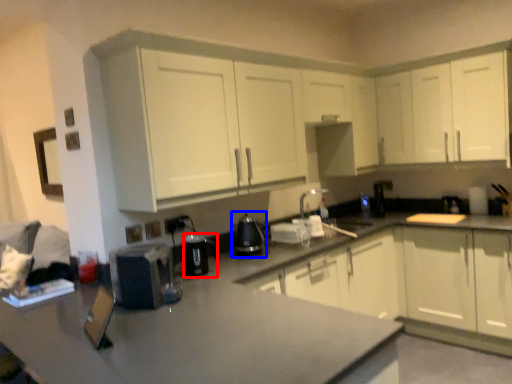
Question: Which object is closer to the camera taking this photo, appliance (highlighted by a red box) or appliance (highlighted by a blue box)?

Choices:
 (A) appliance
 (B) appliance

Answer: (A)